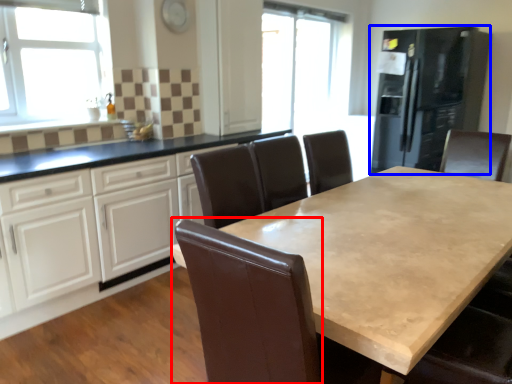
Question: Which point is further to the camera, swivel chair (highlighted by a red box) or fridge (highlighted by a blue box)?

Choices:
 (A) swivel chair
 (B) fridge

Answer: (B)